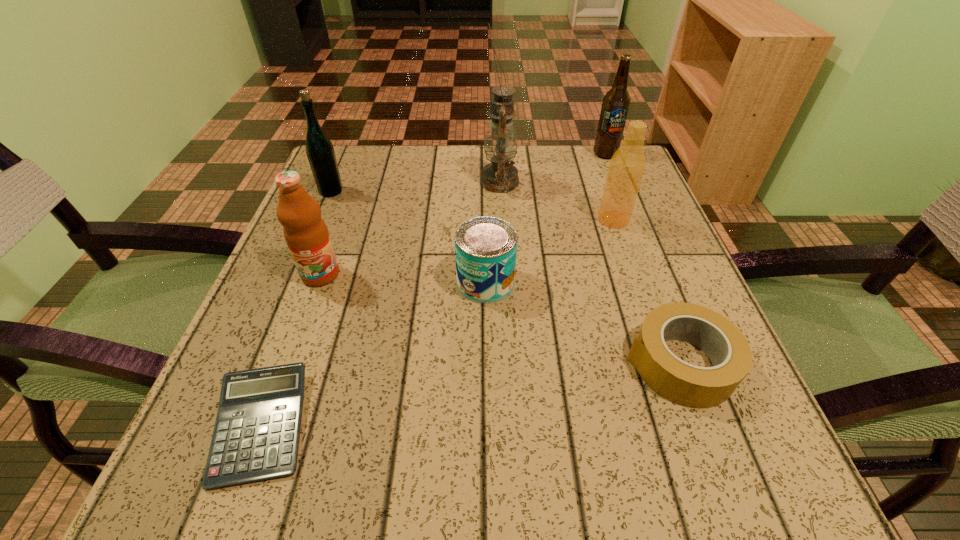
Where is `vacant region located on the front of the leftmost beer bottle`? vacant region located on the front of the leftmost beer bottle is located at coordinates (314, 234).

Identify the location of vacant space located on the left of the nearest beer bottle. (416, 219).

Locate an element on the screen. This screenshot has height=540, width=960. free location located on the front label of the fruit juice is located at coordinates (289, 361).

Identify the location of vacant space located 0.250m on the front of the sixth tallest object. Image resolution: width=960 pixels, height=540 pixels. tap(488, 451).

Find the location of a particular element. Image resolution: width=960 pixels, height=540 pixels. blank area located 0.400m at the edge of the duct tape is located at coordinates click(x=357, y=363).

Identify the location of vacant region located at the edge of the duct tape. Image resolution: width=960 pixels, height=540 pixels. [x=424, y=363].

In order to click on vacant region located 0.070m at the edge of the duct tape in this screenshot , I will do `click(580, 363)`.

This screenshot has width=960, height=540. Identify the location of free spot located 0.150m on the back of the shortest object. (309, 296).

Identify the location of oil lamp present at the far edge. (501, 142).

You are a GUI agent. You are given a task and a screenshot of the screen. Output one action in this format:
    pyautogui.click(x=<x>, y=<y>)
    Task: Click on the object positioned at the near edge
    The height and width of the screenshot is (540, 960).
    Given the screenshot: What is the action you would take?
    pyautogui.click(x=256, y=435)